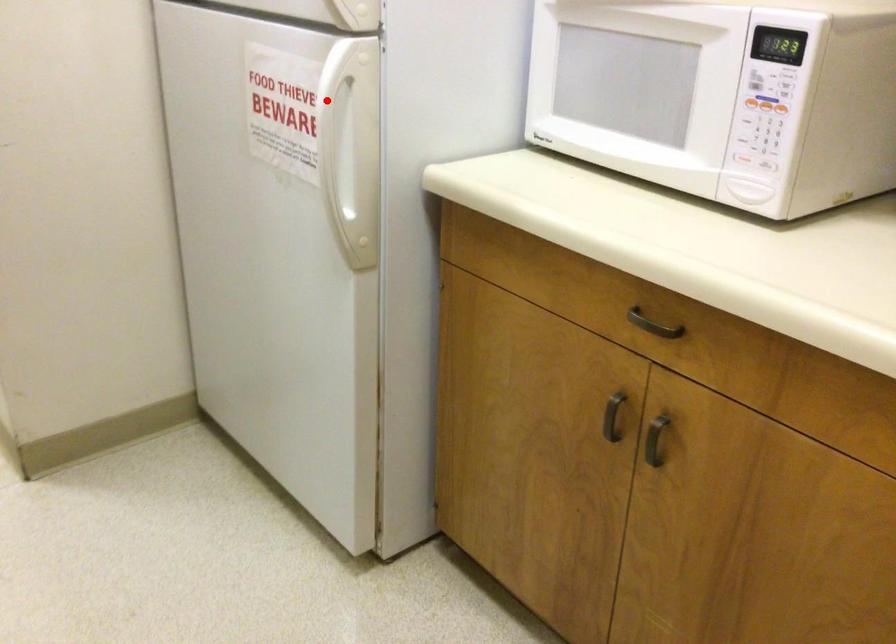
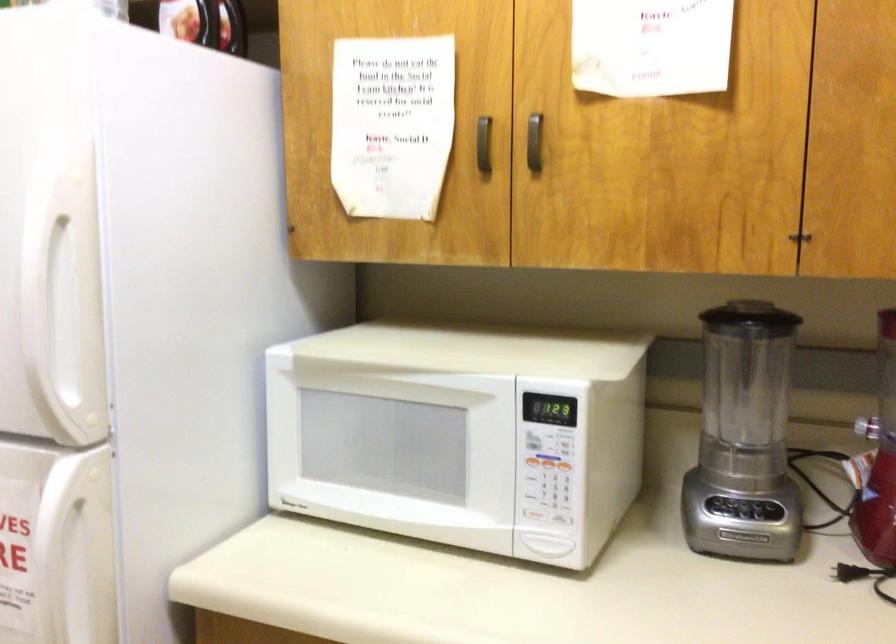
Find the pixel in the second image that matches the highlighted location in the first image.

(57, 538)